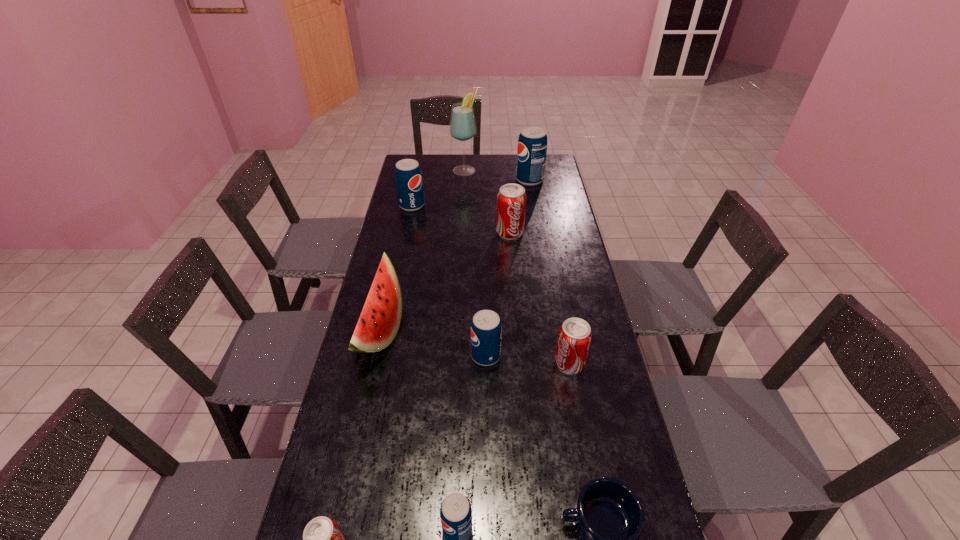
Identify the location of alcohol. (462, 127).

You are a GUI agent. You are given a task and a screenshot of the screen. Output one action in this format:
    pyautogui.click(x=<x>, y=<y>)
    Task: Click on the tallest pop
    This screenshot has width=960, height=540.
    Given the screenshot: What is the action you would take?
    pyautogui.click(x=532, y=144)

Image resolution: width=960 pixels, height=540 pixels. In order to click on the farthest blue pop in this screenshot , I will do `click(532, 144)`.

Identify the location of the third smallest blue pop. This screenshot has height=540, width=960. (408, 176).

At what (x,y) coordinates should I click in order to perform the action: click on the third nearest blue pop. Please return your answer as a coordinate pair (x, y). This screenshot has width=960, height=540. Looking at the image, I should click on (408, 176).

I want to click on the second red soda can from left to right, so click(511, 200).

Where is `the fifth nearest pop`? the fifth nearest pop is located at coordinates (511, 200).

Find the location of `green watermelon`. green watermelon is located at coordinates pos(378,324).

You are a GUI agent. You are given a task and a screenshot of the screen. Output one action in this format:
    pyautogui.click(x=<x>, y=<y>)
    Task: Click on the third farthest blue pop
    The height and width of the screenshot is (540, 960).
    Given the screenshot: What is the action you would take?
    pyautogui.click(x=486, y=329)

Locate an element on the screen. the second farthest red soda can is located at coordinates (574, 338).